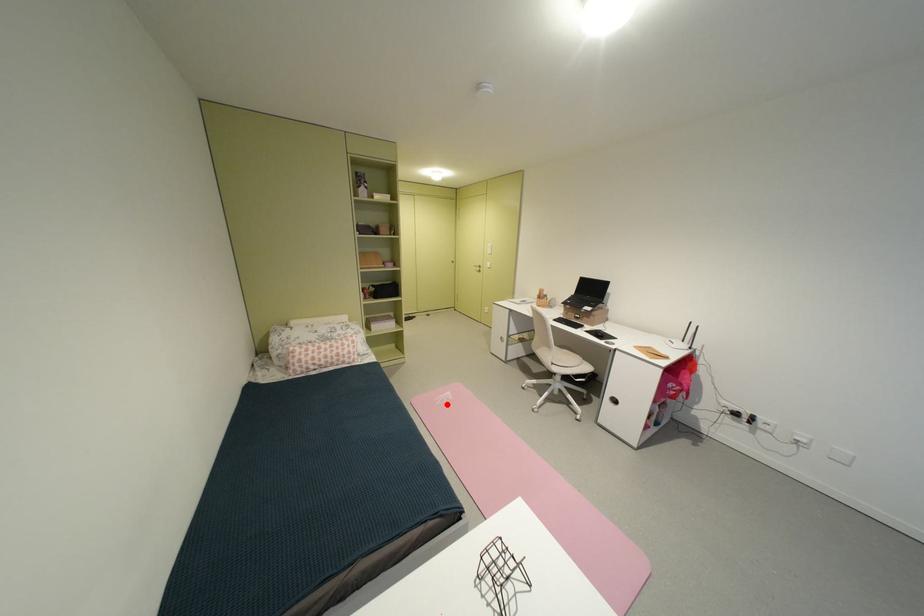
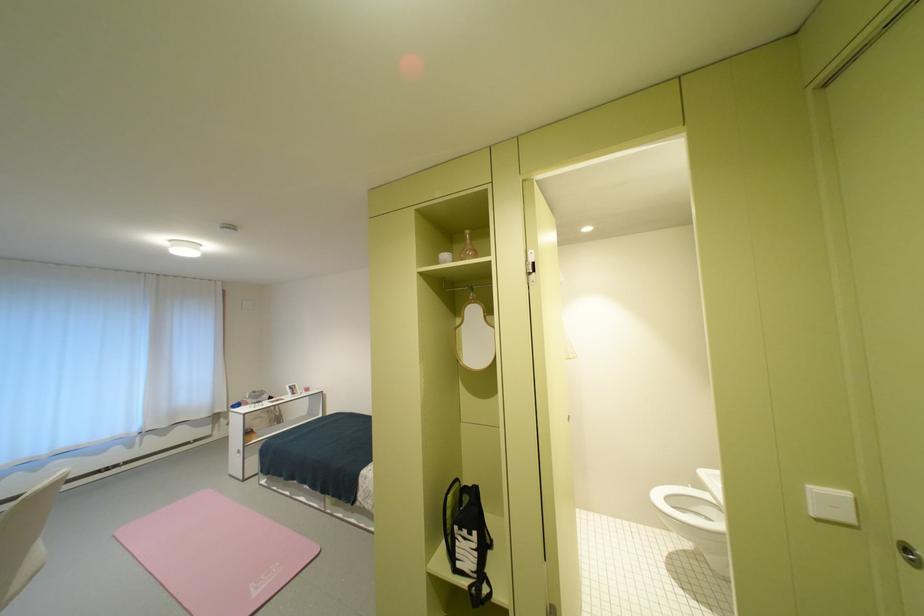
Locate, in the second image, the point that corresponds to the highlighted location in the first image.

(286, 565)